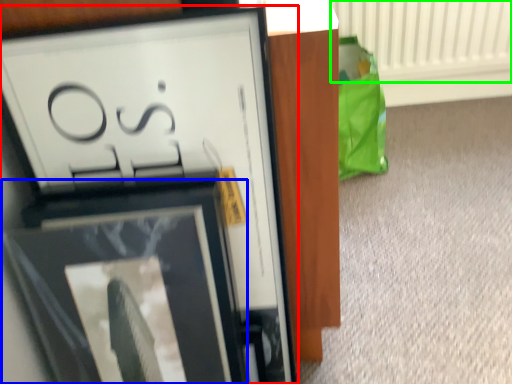
Question: Which is farther away from picture frame (highlighted by a red box)? picture frame (highlighted by a blue box) or radiator (highlighted by a green box)?

Choices:
 (A) picture frame
 (B) radiator

Answer: (B)